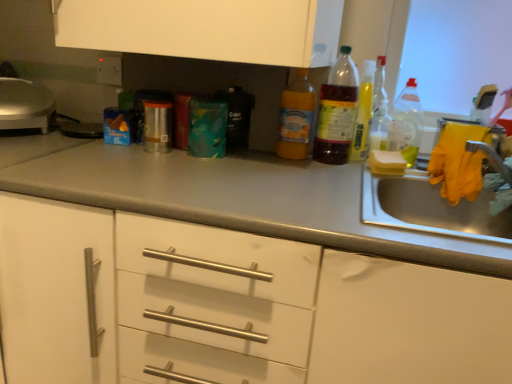
Question: Based on their positions, is white sponge at sink located to the left or right of translucent plastic bottle at center, the 2th bottle in the left-to-right sequence?

Choices:
 (A) right
 (B) left

Answer: (A)

Question: Is point (391, 160) closer or farther from the camera than point (322, 102)?

Choices:
 (A) closer
 (B) farther

Answer: (A)

Question: Considering the real-world distances, which object is closest to the translucent plastic bottle at center, the 5th bottle in the right-to-left sequence?

Choices:
 (A) shiny silver waffle maker at left
 (B) translucent plastic bottle at right, which is the 5th bottle from left to right
 (C) white sponge at sink
 (D) gray matte countertop at center
 (E) translucent plastic bottle at center, the 2th bottle in the left-to-right sequence

Answer: (E)

Question: Which is nearer to the shiny silver waffle maker at left?

Choices:
 (A) translucent plastic bottle at center, the 5th bottle in the right-to-left sequence
 (B) gray matte countertop at center
 (C) white sponge at sink
 (D) translucent plastic bottle at right, the fourth bottle positioned from the left
 (E) translucent plastic bottle at upper right, arranged as the third bottle when viewed from the right

Answer: (B)